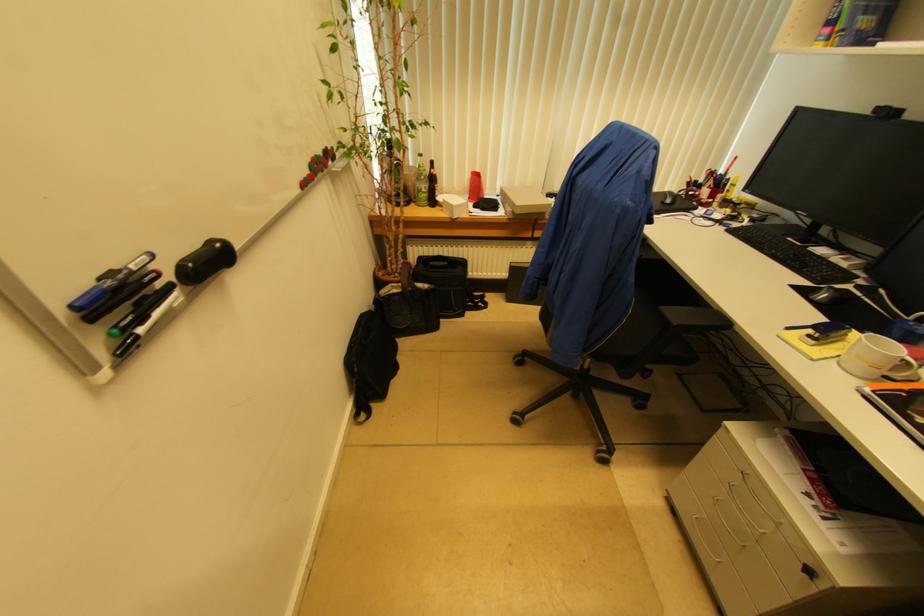
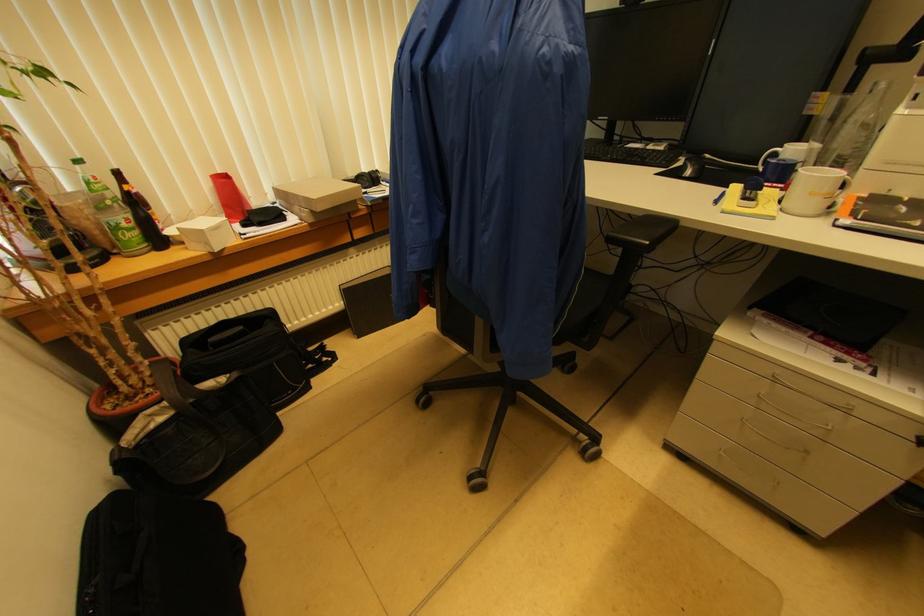
Where in the second image is the point corresponding to pixel 454 215 from the first image?

(209, 246)